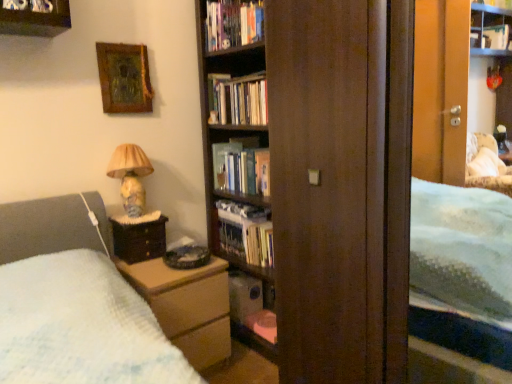
Identify the location of free space above hardcover book at center, the 5th book in the top-to-bottom sequence (from a real-world perspective). The width and height of the screenshot is (512, 384). (258, 221).